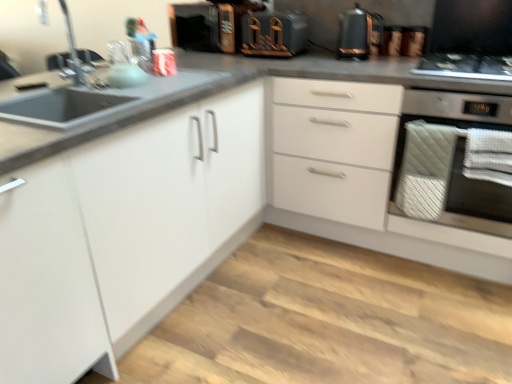
Identify the location of free space to the left of matte silver faucet at upper left. This screenshot has height=384, width=512. (40, 99).